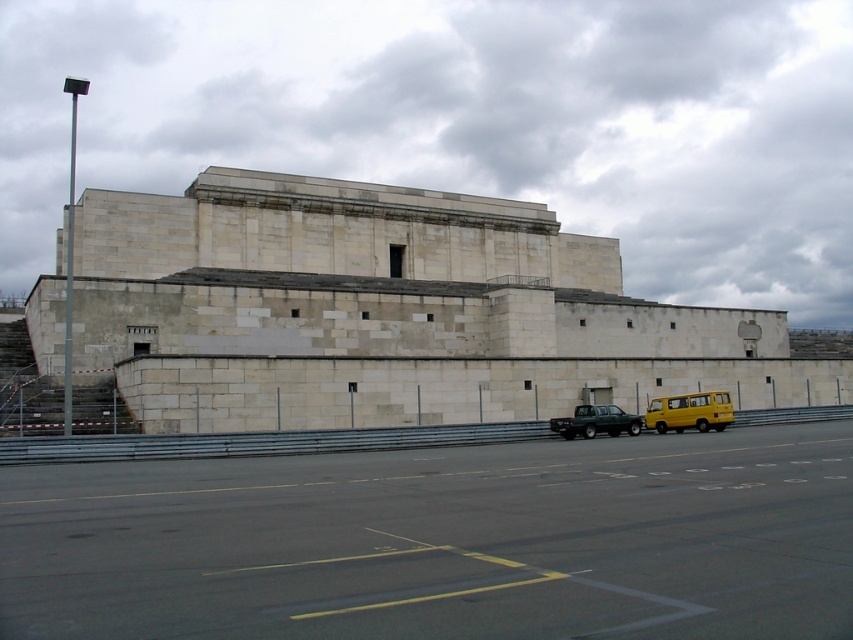
Does yellow matte van at lower right have a lesser width compared to matte black truck at center?

No.

Is point (704, 412) farther from camera compared to point (590, 422)?

Yes.

This screenshot has width=853, height=640. I want to click on yellow matte van at lower right, so click(x=689, y=412).